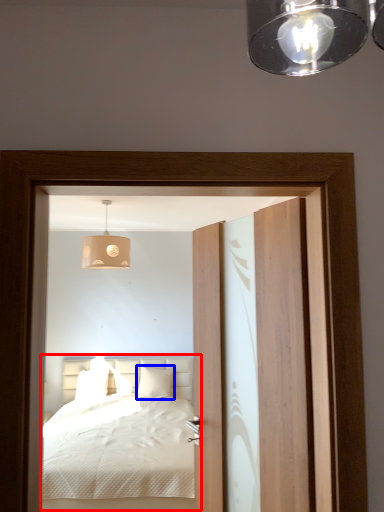
Question: Which object appears closest to the camera in this image, bed (highlighted by a red box) or pillow (highlighted by a blue box)?

Choices:
 (A) bed
 (B) pillow

Answer: (A)